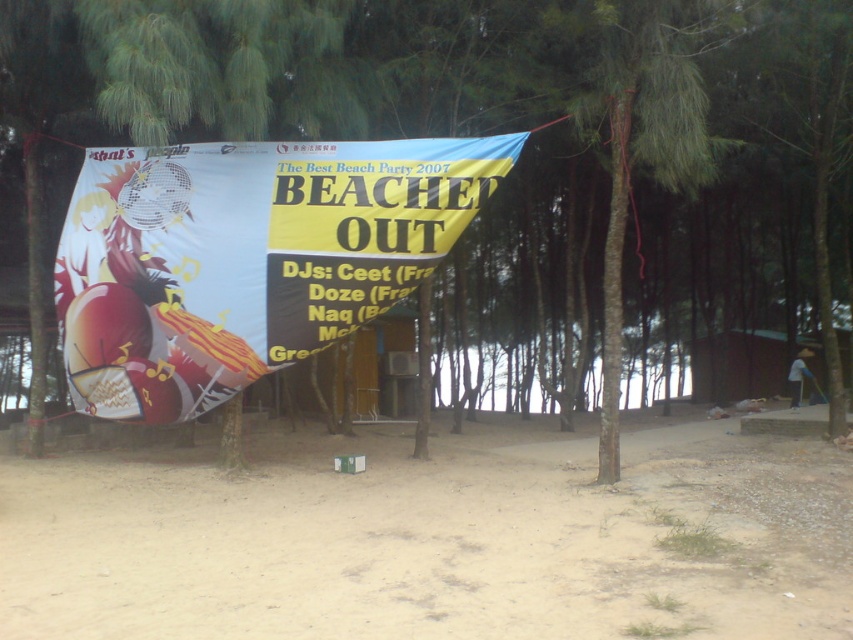
Question: In this image, where is sandy brown dirt at lower center located relative to white glossy banner at center?

Choices:
 (A) below
 (B) above

Answer: (A)

Question: Does sandy brown dirt at lower center have a greater width compared to white glossy banner at center?

Choices:
 (A) no
 (B) yes

Answer: (B)

Question: Considering the relative positions of sandy brown dirt at lower center and white glossy banner at center in the image provided, where is sandy brown dirt at lower center located with respect to white glossy banner at center?

Choices:
 (A) left
 (B) right

Answer: (B)

Question: Which object is farther from the camera taking this photo?

Choices:
 (A) white glossy banner at center
 (B) sandy brown dirt at lower center

Answer: (A)

Question: Which point is farther to the camera?

Choices:
 (A) (389, 256)
 (B) (584, 467)

Answer: (B)